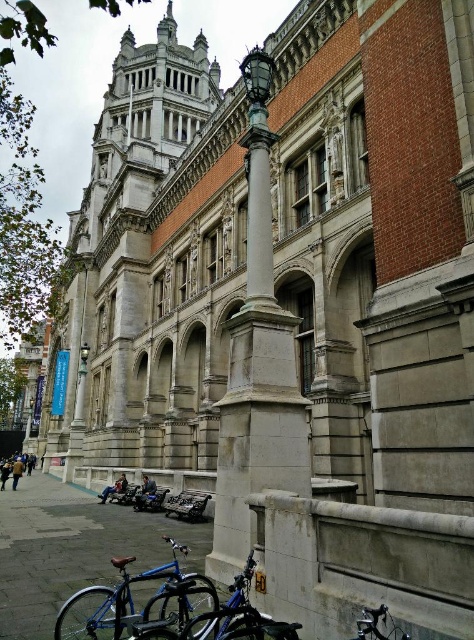
You are a delivery person trying to park your blue metallic bicycle at lower left near the building entrance. There is a slate gray stone column at center in the way. Can you fit your bicycle between the column and the building wall?

The slate gray stone column at center is bigger than the blue metallic bicycle at lower left, but the exact distance between the column and the wall isn

Consider the image. You are a delivery person trying to park your blue matte bicycle at lower left near the building entrance. There is a slate gray stone column at center blocking the path. Can you easily ride your bicycle around the column to reach the entrance?

The slate gray stone column at center is much taller than the blue matte bicycle at lower left, but height does not affect the ability to maneuver around it. Since the column is a fixed obstacle, you can easily ride your blue matte bicycle at lower left around it to reach the entrance.

You are a delivery person arriving at the historic building and need to park your blue matte bicycle at lower left. The slate gray stone column at center is in the way. Can you move the bicycle to the side of the column without going behind it?

The slate gray stone column at center is positioned over the blue matte bicycle at lower left, which means the column is directly above the bicycle. Since the column is a fixed structure, you cannot move it. Therefore, you cannot move the bicycle to the side of the column without going behind it.